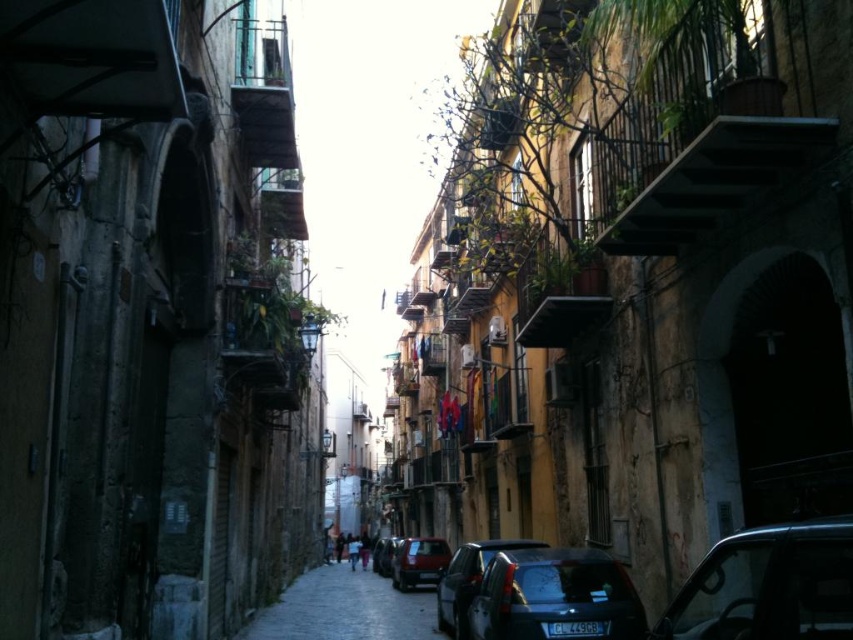
Question: Which object appears farthest from the camera in this image?

Choices:
 (A) shiny dark blue car at center
 (B) dark gray cobblestone alley at center
 (C) shiny black car at center

Answer: (C)

Question: Which point appears farthest from the camera in this image?

Choices:
 (A) (375, 552)
 (B) (450, 588)

Answer: (A)

Question: Which object is positioned closest to the dark gray cobblestone alley at center?

Choices:
 (A) shiny black car at center
 (B) shiny dark blue car at center

Answer: (A)

Question: Is dark gray cobblestone alley at center to the right of shiny blue car at lower center from the viewer's perspective?

Choices:
 (A) yes
 (B) no

Answer: (B)

Question: Is the position of shiny black car at lower right more distant than that of matte red car at center?

Choices:
 (A) no
 (B) yes

Answer: (A)

Question: Does shiny dark blue car at center appear on the left side of matte red car at center?

Choices:
 (A) no
 (B) yes

Answer: (A)